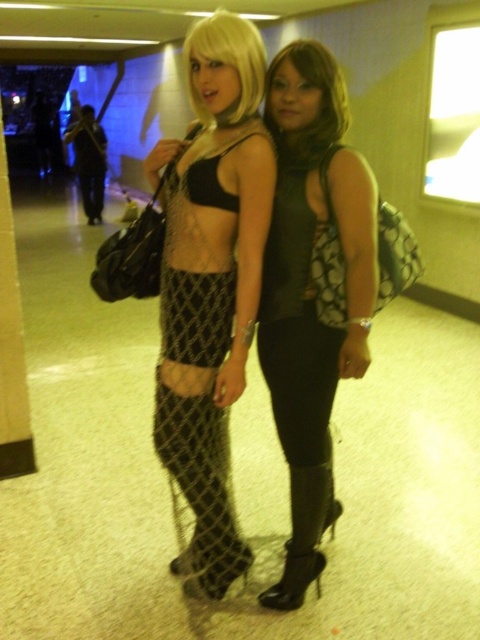
Question: Which point appears closest to the camera in this image?

Choices:
 (A) (299, 154)
 (B) (215, 499)
 (C) (333, 374)
 (D) (216, 449)

Answer: (A)

Question: Is matte black mesh skirt at center smaller than matte black top at center?

Choices:
 (A) yes
 (B) no

Answer: (B)

Question: Where is matte black top at center located in relation to matte black purse at center in the image?

Choices:
 (A) above
 (B) below

Answer: (B)

Question: Does matte black top at center appear on the right side of netted fabric legging at center?

Choices:
 (A) yes
 (B) no

Answer: (A)

Question: Which point is closer to the camera?

Choices:
 (A) matte black purse at center
 (B) matte black top at center
 (C) netted fabric legging at center
 (D) shiny black boots at center

Answer: (B)

Question: Which point is farther to the camera?

Choices:
 (A) (210, 364)
 (B) (323, 400)

Answer: (B)